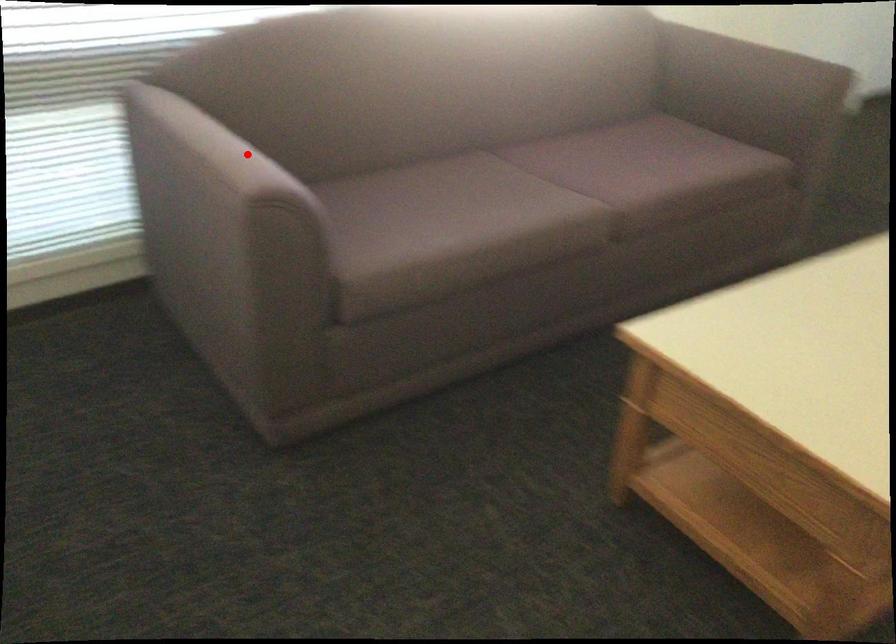
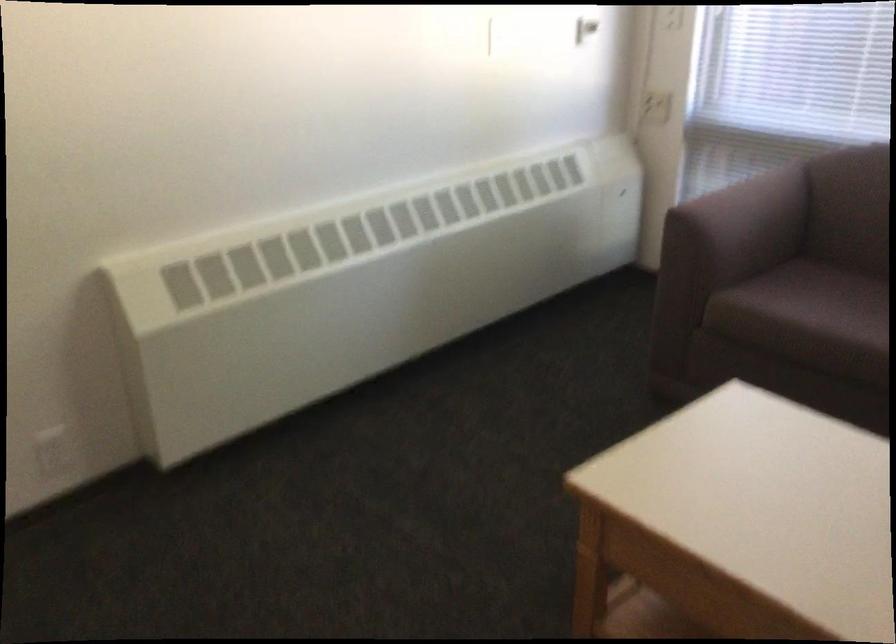
Question: I am providing you with two images of the same scene from different viewpoints. Given a red point in image1, look at the same physical point in image2. Is it:

Choices:
 (A) Closer to the viewpoint
 (B) Farther from the viewpoint

Answer: (B)